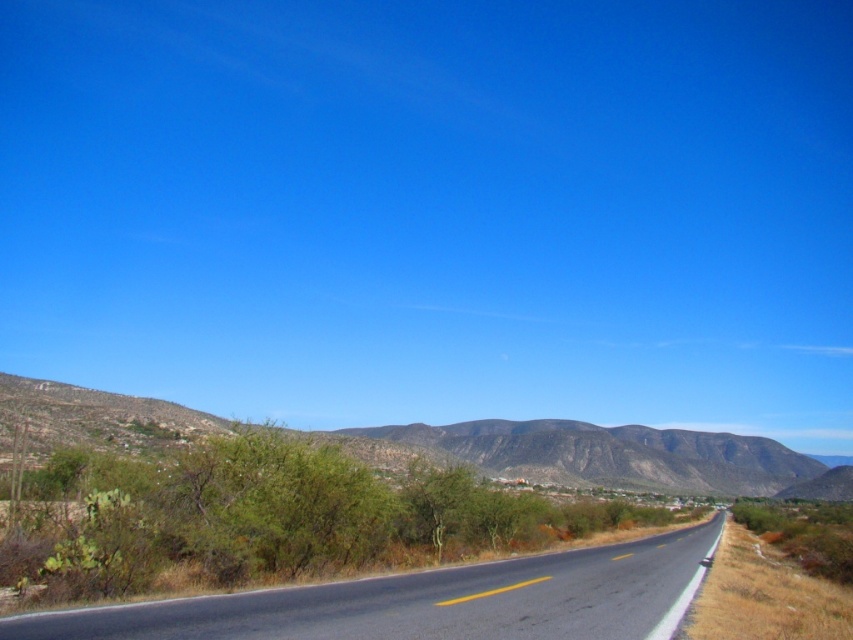
You are standing at the point with coordinates (x=430, y=602) in the image. What object are you currently standing on?

The point at (x=430, y=602) corresponds to the black asphalt road at center, so you are standing on the black asphalt road at center.

Looking at this image, you are a drone operator trying to capture a photo of the black asphalt road at center. The camera is currently positioned at point A, which is at coordinates 0.9, 0.5. To ensure the road is centered in the photo, should you adjust the camera position to the left or right? Please provide your answer based on the coordinates provided.

The black asphalt road at center is located at point (430,602). Since the camera is at (426,576), which is slightly to the left and slightly below the road, you should adjust the camera position to the right and slightly upward to center the road in the photo.

You are driving along the black asphalt road at center and want to make a U turn. There is a green shrubbery at lower left nearby. Can you safely make a U turn without crossing the double yellow line? Please explain your reasoning.

The black asphalt road at center is to the left of the green shrubbery at lower left. Since the road is straight and the shrubbery is on the lower left, you can safely make a U turn by staying on the left side of the road without crossing the double yellow line.